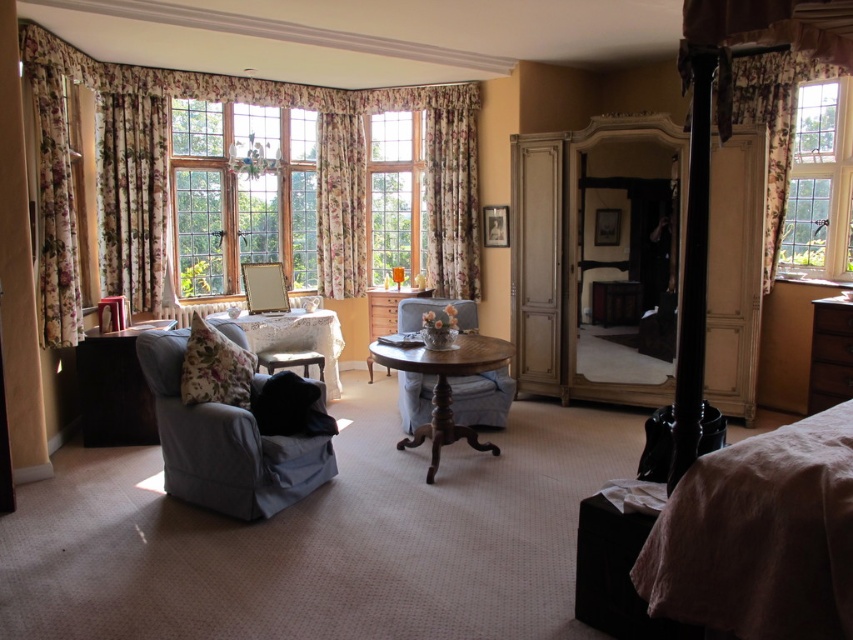
Does point (753, 547) lie behind point (468, 337)?

No, it is in front of (468, 337).

Who is more distant from viewer, (709, 627) or (434, 394)?

Point (434, 394)

Which is in front, point (837, 499) or point (466, 353)?

Point (837, 499)

Where is `brown linen bed at lower right`? brown linen bed at lower right is located at coordinates (759, 536).

Is floral fabric curtain at left to the right of floral fabric curtain at upper right from the viewer's perspective?

In fact, floral fabric curtain at left is to the left of floral fabric curtain at upper right.

Does point (160, 234) come farther from viewer compared to point (770, 244)?

Yes, point (160, 234) is farther from viewer.

At what (x,y) coordinates should I click in order to perform the action: click on floral fabric curtain at left. Please return your answer as a coordinate pair (x, y). The height and width of the screenshot is (640, 853). Looking at the image, I should click on (132, 195).

Image resolution: width=853 pixels, height=640 pixels. What are the coordinates of `floral fabric curtains at upper left` in the screenshot? It's located at (317, 164).

Consider the image. Does floral fabric curtains at upper left have a lesser width compared to velvet blue armchair at center?

No, floral fabric curtains at upper left is not thinner than velvet blue armchair at center.

Image resolution: width=853 pixels, height=640 pixels. I want to click on floral fabric curtains at upper left, so click(317, 164).